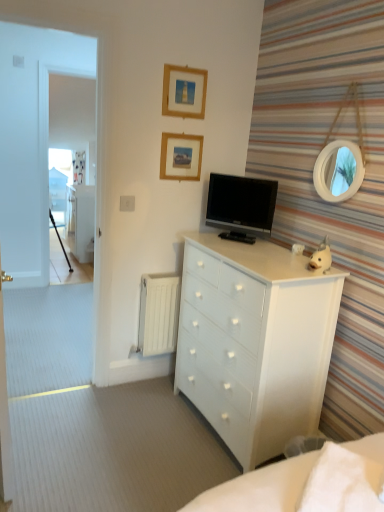
Find the location of a particular element. This screenshot has height=512, width=384. free space above white fluffy pillow at lower right (from a real-world perspective) is located at coordinates tap(352, 478).